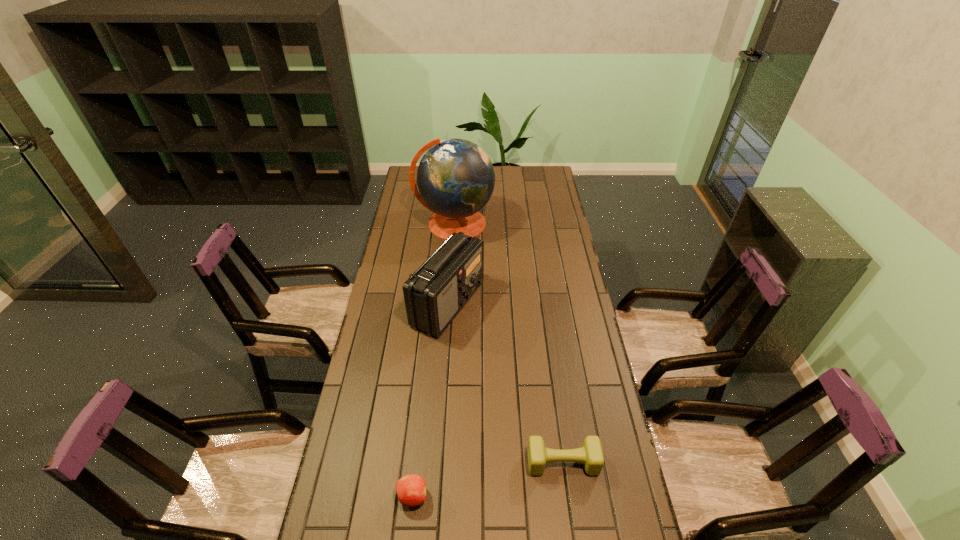
The height and width of the screenshot is (540, 960). I want to click on the tallest object, so click(x=455, y=178).

Where is `the farthest object`? The width and height of the screenshot is (960, 540). the farthest object is located at coordinates (455, 178).

The image size is (960, 540). I want to click on the second tallest object, so click(434, 294).

Identify the location of the third nearest object. The image size is (960, 540). (434, 294).

I want to click on dumbbell, so click(x=590, y=454).

The width and height of the screenshot is (960, 540). I want to click on the third farthest object, so click(x=590, y=454).

At what (x,y) coordinates should I click in order to perform the action: click on apple. Please return your answer as a coordinate pair (x, y). Looking at the image, I should click on (411, 489).

Locate an element on the screen. Image resolution: width=960 pixels, height=540 pixels. blank space located 0.400m with the Americas facing the viewer on the farthest object is located at coordinates (448, 313).

Where is `vacant region located 0.080m on the front panel of the radio receiver`? The height and width of the screenshot is (540, 960). vacant region located 0.080m on the front panel of the radio receiver is located at coordinates (504, 303).

You are a GUI agent. You are given a task and a screenshot of the screen. Output one action in this format:
    pyautogui.click(x=<x>, y=<y>)
    Task: Click on the free region located 0.080m on the front of the dumbbell
    The image size is (960, 540).
    Given the screenshot: What is the action you would take?
    pyautogui.click(x=568, y=508)